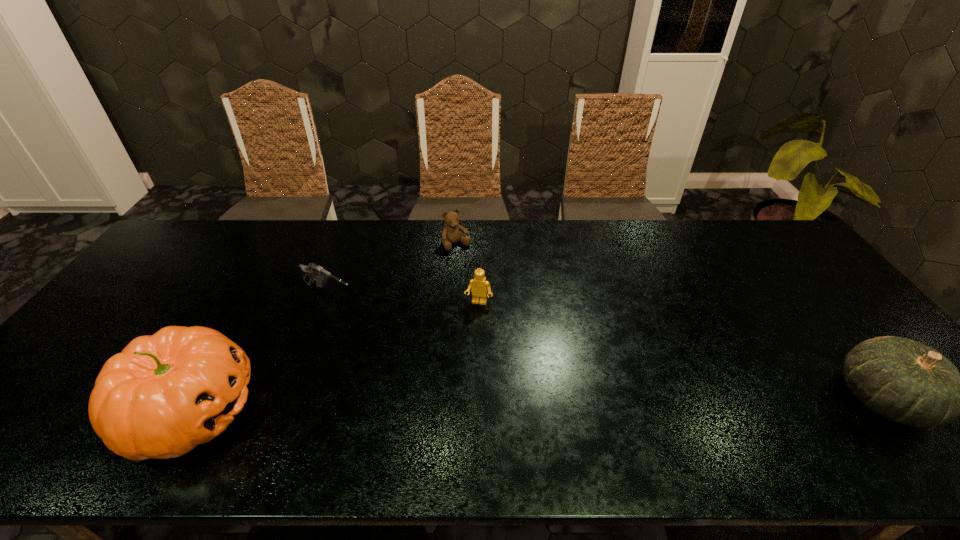
I want to click on free space located 0.130m at the barrel of the gun, so click(383, 325).

Locate an element on the screen. This screenshot has width=960, height=540. vacant space located on the face of the Lego is located at coordinates (449, 406).

Find the location of a particular element. This screenshot has height=540, width=960. free space located on the face of the Lego is located at coordinates (449, 406).

This screenshot has height=540, width=960. What are the coordinates of `vacant space located on the face of the Lego` in the screenshot? It's located at 471,325.

Image resolution: width=960 pixels, height=540 pixels. Identify the location of object situated at the far edge. point(451,233).

Locate an element on the screen. The height and width of the screenshot is (540, 960). object that is at the near edge is located at coordinates (164, 394).

Identify the location of free region at the far edge. Image resolution: width=960 pixels, height=540 pixels. (723, 246).

The image size is (960, 540). What are the coordinates of `vacant space at the left edge of the desktop` in the screenshot? It's located at (91, 339).

Locate an element on the screen. Image resolution: width=960 pixels, height=540 pixels. vacant space at the right edge of the desktop is located at coordinates (775, 267).

Image resolution: width=960 pixels, height=540 pixels. What are the coordinates of `vacant space at the far left corner of the desktop` in the screenshot? It's located at (178, 238).